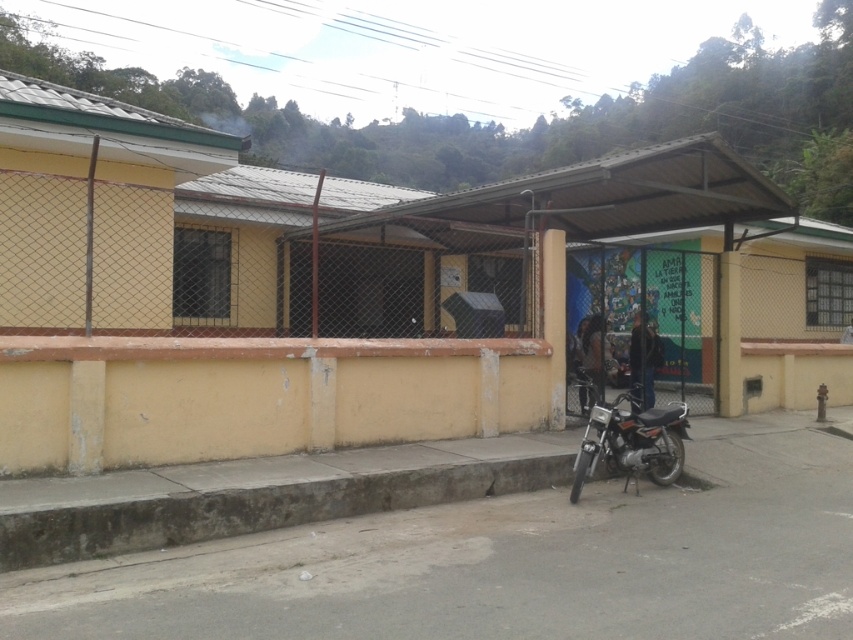
You are standing on the sidewalk in front of the building and want to walk to the point marked as point [254,508]. Is the path clear of obstacles between your current position and the point?

The point [254,508] is on concrete at lower left, so the path is clear of obstacles between your current position and the point since it is on the concrete sidewalk.

You are a delivery person standing on the sidewalk in front of the building. You need to place a package on the concrete at lower left and the metallic silver motorcycle at lower right. Which location is closer to your current position?

The concrete at lower left is closer to the viewer than the metallic silver motorcycle at lower right, so the concrete at lower left is closer to your current position.